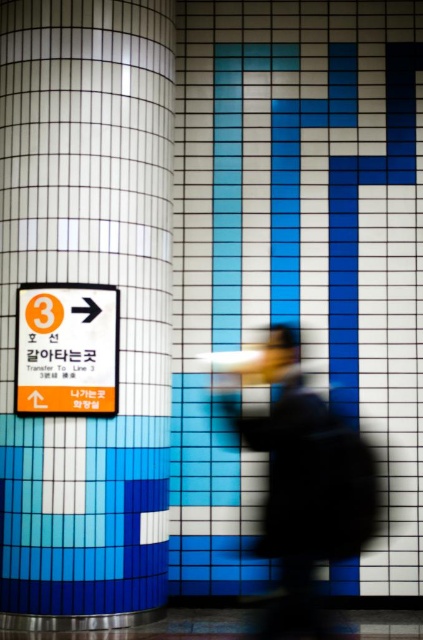
Question: Where is white glossy pillar at left located in relation to silhouette coat at center in the image?

Choices:
 (A) above
 (B) below

Answer: (A)

Question: Which of the following is the farthest from the observer?

Choices:
 (A) orange plastic sign at left
 (B) silhouette coat at center

Answer: (A)

Question: Estimate the real-world distances between objects in this image. Which object is closer to the white glossy pillar at left?

Choices:
 (A) silhouette coat at center
 (B) orange plastic sign at left

Answer: (B)

Question: Does white glossy pillar at left have a larger size compared to orange plastic sign at left?

Choices:
 (A) no
 (B) yes

Answer: (B)

Question: Can you confirm if silhouette coat at center is thinner than orange plastic sign at left?

Choices:
 (A) no
 (B) yes

Answer: (A)

Question: Which of the following is the farthest from the observer?

Choices:
 (A) orange plastic sign at left
 (B) silhouette coat at center
 (C) white glossy pillar at left

Answer: (A)